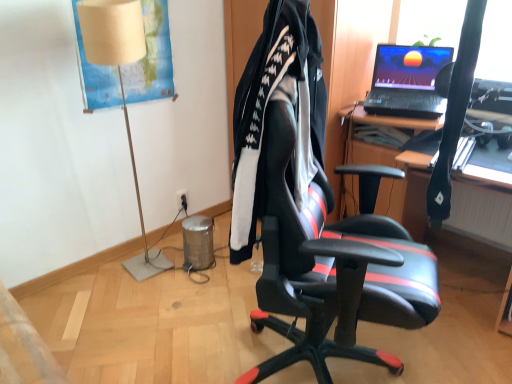
At what (x,y) coordinates should I click in order to perform the action: click on black plastic power outlet at lower center. Please return your answer as a coordinate pair (x, y). Looking at the image, I should click on (182, 199).

Locate an element on the screen. black leather chair at center is located at coordinates (312, 214).

Is there a large distance between black plastic power outlet at lower center and black fabric jacket at center?

Yes.

From a real-world perspective, is black plastic power outlet at lower center below black fabric jacket at center?

Yes, from a real-world perspective, black plastic power outlet at lower center is below black fabric jacket at center.

Considering the sizes of objects black plastic power outlet at lower center and black fabric jacket at center in the image provided, who is wider, black plastic power outlet at lower center or black fabric jacket at center?

black fabric jacket at center.

Consider the image. Between black plastic power outlet at lower center and black fabric jacket at center, which one is positioned behind?

black plastic power outlet at lower center is further from the camera.

Looking at this image, considering the relative sizes of black plastic power outlet at lower center and black leather chair at center in the image provided, is black plastic power outlet at lower center taller than black leather chair at center?

Incorrect, the height of black plastic power outlet at lower center is not larger of that of black leather chair at center.

From the picture: Could you tell me if black plastic power outlet at lower center is facing black leather chair at center?

Yes, black plastic power outlet at lower center is oriented towards black leather chair at center.

Looking at the image, does black plastic power outlet at lower center seem bigger or smaller compared to black leather chair at center?

In the image, black plastic power outlet at lower center appears to be smaller than black leather chair at center.

Looking at this image, who is shorter, black fabric jacket at center or beige fabric lampshade at left?

black fabric jacket at center.

Which object is further away from the camera, black fabric jacket at center or beige fabric lampshade at left?

beige fabric lampshade at left is more distant.

Can you confirm if black plastic power outlet at lower center is bigger than beige fabric lampshade at left?

No.

From the image's perspective, would you say black plastic power outlet at lower center is positioned over beige fabric lampshade at left?

Incorrect, from the image's perspective, black plastic power outlet at lower center is lower than beige fabric lampshade at left.

Is point (178, 194) positioned before point (138, 204)?

No, it is behind (138, 204).

Would you say black plastic power outlet at lower center is inside or outside beige fabric lampshade at left?

black plastic power outlet at lower center is not enclosed by beige fabric lampshade at left.

Is black leather chair at center wider than black plastic power outlet at lower center?

Yes, black leather chair at center is wider than black plastic power outlet at lower center.

From a real-world perspective, who is located lower, black leather chair at center or black plastic power outlet at lower center?

From a 3D spatial view, black plastic power outlet at lower center is below.

Could you tell me if black leather chair at center is facing black plastic power outlet at lower center?

No.

Is black leather chair at center taller or shorter than black plastic power outlet at lower center?

Considering their sizes, black leather chair at center has more height than black plastic power outlet at lower center.

From the image's perspective, between black fabric jacket at center and black leather chair at center, who is located below?

black leather chair at center.

Does black fabric jacket at center touch black leather chair at center?

No, black fabric jacket at center is not making contact with black leather chair at center.

In the scene shown: Who is taller, black fabric jacket at center or black leather chair at center?

With more height is black leather chair at center.

Consider the image. From a real-world perspective, which is physically above, black fabric jacket at center or black leather chair at center?

black fabric jacket at center.

Image resolution: width=512 pixels, height=384 pixels. Find the location of `chair that is under the black fabric jacket at center (from a real-world perspective)`. chair that is under the black fabric jacket at center (from a real-world perspective) is located at coordinates (312, 214).

From a real-world perspective, is black leather chair at center over black fabric jacket at center?

Incorrect, from a real-world perspective, black leather chair at center is lower than black fabric jacket at center.

Based on the photo, who is more distant, black leather chair at center or black fabric jacket at center?

black fabric jacket at center is behind.

From the image's perspective, who appears lower, black leather chair at center or black fabric jacket at center?

black leather chair at center appears lower in the image.

This screenshot has width=512, height=384. Identify the location of power outlet beneath the black fabric jacket at center (from a real-world perspective). (182, 199).

Image resolution: width=512 pixels, height=384 pixels. Find the location of `chair that is below the black plastic power outlet at lower center (from the image's perspective)`. chair that is below the black plastic power outlet at lower center (from the image's perspective) is located at coordinates (312, 214).

Which object lies further to the anchor point beige fabric lampshade at left, black plastic power outlet at lower center or black fabric jacket at center?

black fabric jacket at center lies further to beige fabric lampshade at left than the other object.

Looking at the image, which one is located further to black fabric jacket at center, beige fabric lampshade at left or black plastic power outlet at lower center?

Based on the image, black plastic power outlet at lower center appears to be further to black fabric jacket at center.

Looking at the image, which one is located further to beige fabric lampshade at left, black leather chair at center or black fabric jacket at center?

Based on the image, black fabric jacket at center appears to be further to beige fabric lampshade at left.

Consider the image. Based on their spatial positions, is black leather chair at center or beige fabric lampshade at left further from black fabric jacket at center?

Among the two, beige fabric lampshade at left is located further to black fabric jacket at center.

Considering their positions, is black plastic power outlet at lower center positioned closer to black leather chair at center than beige fabric lampshade at left?

beige fabric lampshade at left is closer to black leather chair at center.

Considering their positions, is beige fabric lampshade at left positioned closer to black leather chair at center than black fabric jacket at center?

The object closer to black leather chair at center is black fabric jacket at center.

When comparing their distances from beige fabric lampshade at left, does black fabric jacket at center or black plastic power outlet at lower center seem closer?

Among the two, black plastic power outlet at lower center is located nearer to beige fabric lampshade at left.

Estimate the real-world distances between objects in this image. Which object is closer to black plastic power outlet at lower center, black leather chair at center or beige fabric lampshade at left?

beige fabric lampshade at left lies closer to black plastic power outlet at lower center than the other object.

Locate an element on the screen. The height and width of the screenshot is (384, 512). clothing between black leather chair at center and black plastic power outlet at lower center in the front-back direction is located at coordinates (265, 113).

Find the location of a particular element. The width and height of the screenshot is (512, 384). lamp located between black leather chair at center and black plastic power outlet at lower center in the depth direction is located at coordinates (121, 85).

The image size is (512, 384). I want to click on clothing located between beige fabric lampshade at left and black leather chair at center in the left-right direction, so click(265, 113).

Find the location of a particular element. Image resolution: width=512 pixels, height=384 pixels. lamp between black fabric jacket at center and black plastic power outlet at lower center along the z-axis is located at coordinates (121, 85).